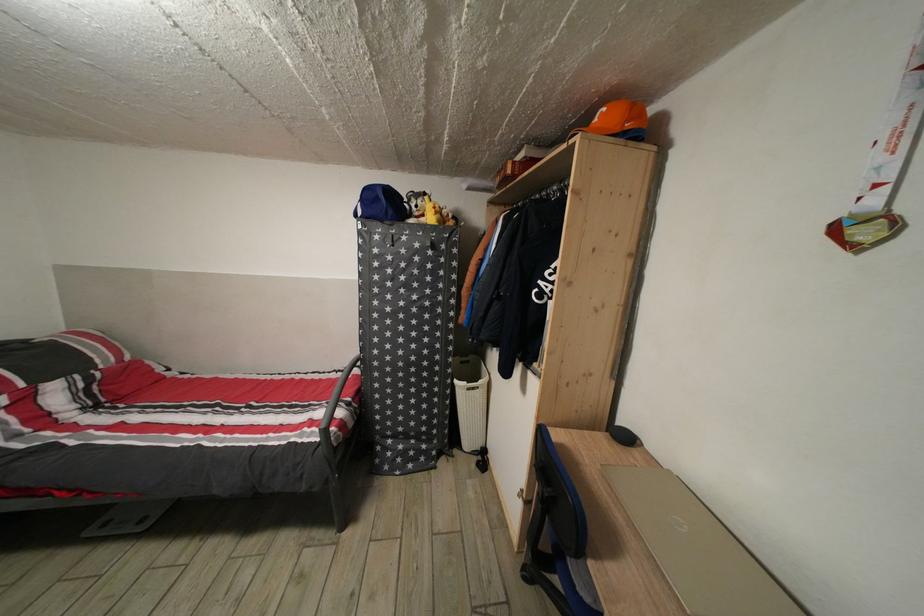
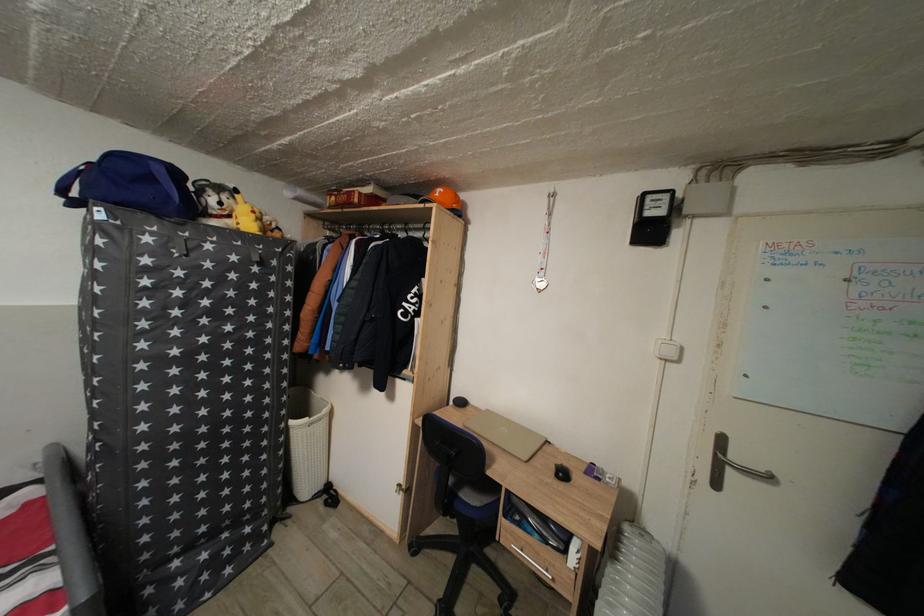
Question: The images are taken continuously from a first-person perspective. In which direction is your viewpoint rotating?

Choices:
 (A) Left
 (B) Right
 (C) Up
 (D) Down

Answer: (B)